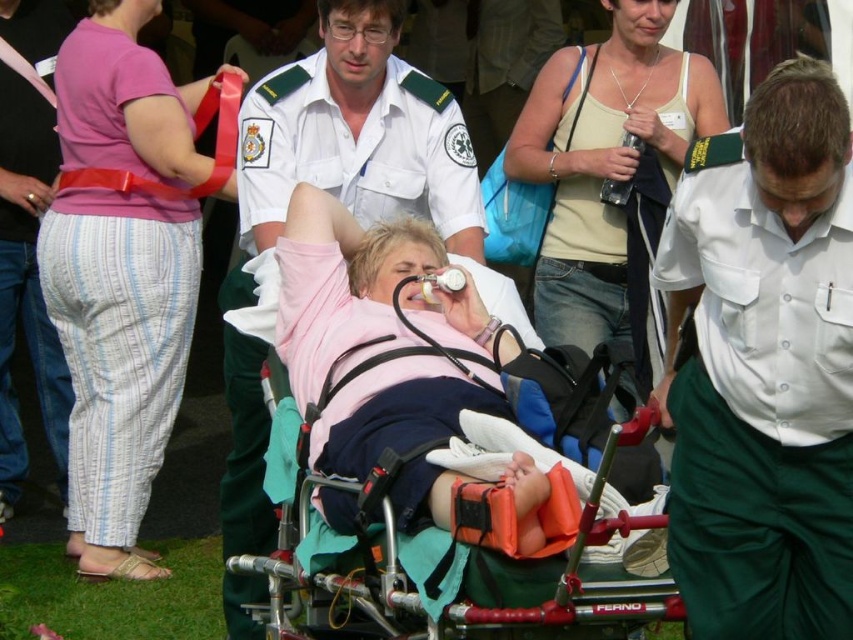
Is white smooth uniform at center shorter than white uniform at center?

Correct, white smooth uniform at center is not as tall as white uniform at center.

Based on the photo, is white smooth uniform at center wider than white uniform at center?

No.

Who is more forward, (796, 218) or (257, 128)?

Point (796, 218) is in front.

Find the location of a particular element. The width and height of the screenshot is (853, 640). white smooth uniform at center is located at coordinates (764, 371).

Can you confirm if pink cotton pants at left is bigger than metallic stretcher at center?

Yes, pink cotton pants at left is bigger than metallic stretcher at center.

Identify the location of pink cotton pants at left. Image resolution: width=853 pixels, height=640 pixels. (122, 273).

Which is behind, point (267, 115) or point (674, 92)?

The point (674, 92) is more distant.

What do you see at coordinates (357, 134) in the screenshot?
I see `white uniform at center` at bounding box center [357, 134].

Does point (430, 96) come in front of point (561, 260)?

That is True.

The width and height of the screenshot is (853, 640). Identify the location of white uniform at center. (357, 134).